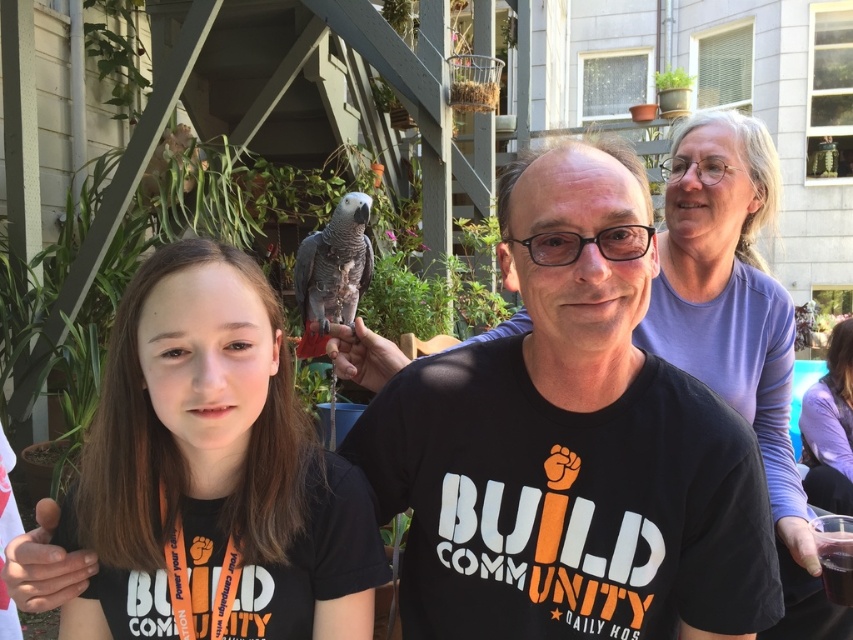
I want to click on matte black shirt at center, so click(x=213, y=467).

Does matte black shirt at center have a lesser width compared to translucent glass cup at lower right?

No, matte black shirt at center is not thinner than translucent glass cup at lower right.

Does point (165, 353) lie behind point (845, 547)?

No, (165, 353) is in front of (845, 547).

Where is `matte black shirt at center`? This screenshot has width=853, height=640. matte black shirt at center is located at coordinates (213, 467).

Describe the element at coordinates (569, 435) in the screenshot. The image size is (853, 640). I see `black matte shirt at center` at that location.

Where is `black matte shirt at center`? The width and height of the screenshot is (853, 640). black matte shirt at center is located at coordinates (569, 435).

Does point (675, 403) come behind point (827, 593)?

No, (675, 403) is closer to viewer.

At what (x,y) coordinates should I click in order to perform the action: click on black matte shirt at center. Please return your answer as a coordinate pair (x, y). The width and height of the screenshot is (853, 640). Looking at the image, I should click on (569, 435).

Does gray matte parrot at center appear on the left side of translucent glass cup at lower right?

Correct, you'll find gray matte parrot at center to the left of translucent glass cup at lower right.

Between gray matte parrot at center and translucent glass cup at lower right, which one appears on the left side from the viewer's perspective?

From the viewer's perspective, gray matte parrot at center appears more on the left side.

Identify the location of gray matte parrot at center. (334, 272).